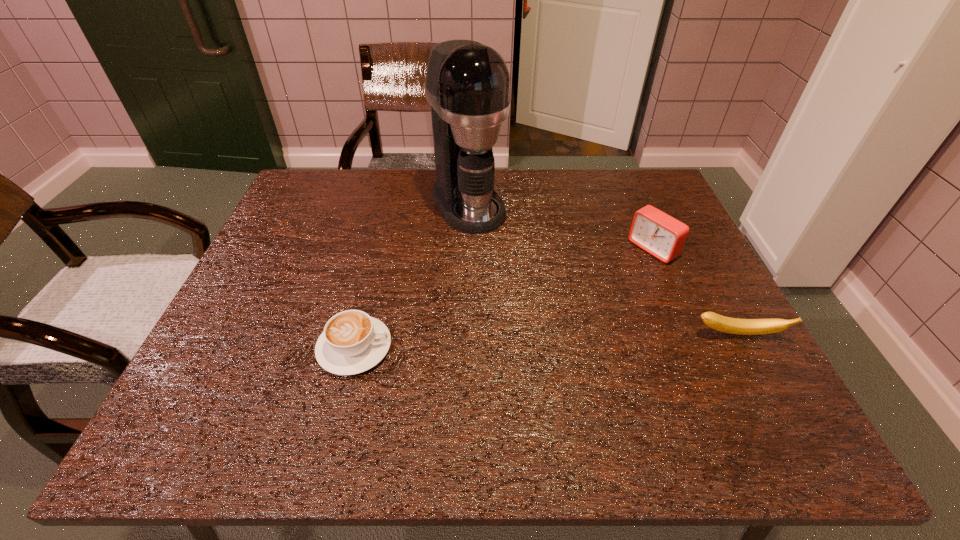
This screenshot has width=960, height=540. Identify the location of free space at the right edge of the desktop. (681, 263).

Locate an element on the screen. This screenshot has width=960, height=540. free space at the far right corner of the desktop is located at coordinates (660, 209).

You are a GUI agent. You are given a task and a screenshot of the screen. Output one action in this format:
    pyautogui.click(x=<x>, y=<y>)
    Task: Click on the vacant space at the near right corner of the desktop
    
    Given the screenshot: What is the action you would take?
    pyautogui.click(x=775, y=392)

Where is `free space between the leftmost object and the alarm clock`? This screenshot has width=960, height=540. free space between the leftmost object and the alarm clock is located at coordinates (503, 299).

Image resolution: width=960 pixels, height=540 pixels. Find the location of `vacant area that lies between the coffee maker and the cappuccino`. vacant area that lies between the coffee maker and the cappuccino is located at coordinates (412, 276).

This screenshot has width=960, height=540. I want to click on unoccupied area between the second tallest object and the coffee maker, so click(x=560, y=227).

The width and height of the screenshot is (960, 540). Identify the location of free space between the third object from right to left and the third shortest object. (560, 227).

Locate an element on the screen. The image size is (960, 540). vacant region between the alarm clock and the banana is located at coordinates (695, 292).

The width and height of the screenshot is (960, 540). What are the coordinates of `free space between the coffee maker and the banana` in the screenshot? It's located at (603, 269).

The image size is (960, 540). I want to click on free spot between the alarm clock and the banana, so click(x=695, y=292).